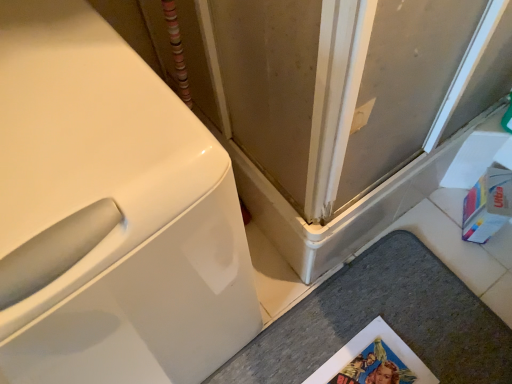
Question: Considering the positions of gray carpet at lower center and white glossy washing machine at left in the image, is gray carpet at lower center wider or thinner than white glossy washing machine at left?

Choices:
 (A) wide
 (B) thin

Answer: (B)

Question: Relative to white glossy washing machine at left, is gray carpet at lower center in front or behind?

Choices:
 (A) front
 (B) behind

Answer: (B)

Question: In terms of height, does gray carpet at lower center look taller or shorter compared to white glossy washing machine at left?

Choices:
 (A) short
 (B) tall

Answer: (A)

Question: Does point (67, 306) appear closer or farther from the camera than point (387, 279)?

Choices:
 (A) closer
 (B) farther

Answer: (A)

Question: From a real-world perspective, is white glossy washing machine at left positioned above or below gray carpet at lower center?

Choices:
 (A) above
 (B) below

Answer: (A)

Question: Is white glossy washing machine at left in front of or behind gray carpet at lower center in the image?

Choices:
 (A) front
 (B) behind

Answer: (A)

Question: Is white glossy washing machine at left bigger or smaller than gray carpet at lower center?

Choices:
 (A) small
 (B) big

Answer: (B)